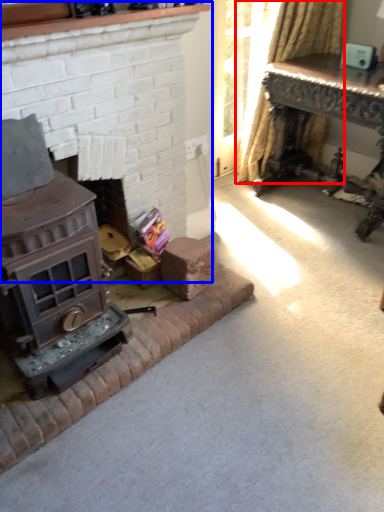
Question: Which object appears farthest to the camera in this image, curtain (highlighted by a red box) or fireplace (highlighted by a blue box)?

Choices:
 (A) curtain
 (B) fireplace

Answer: (A)